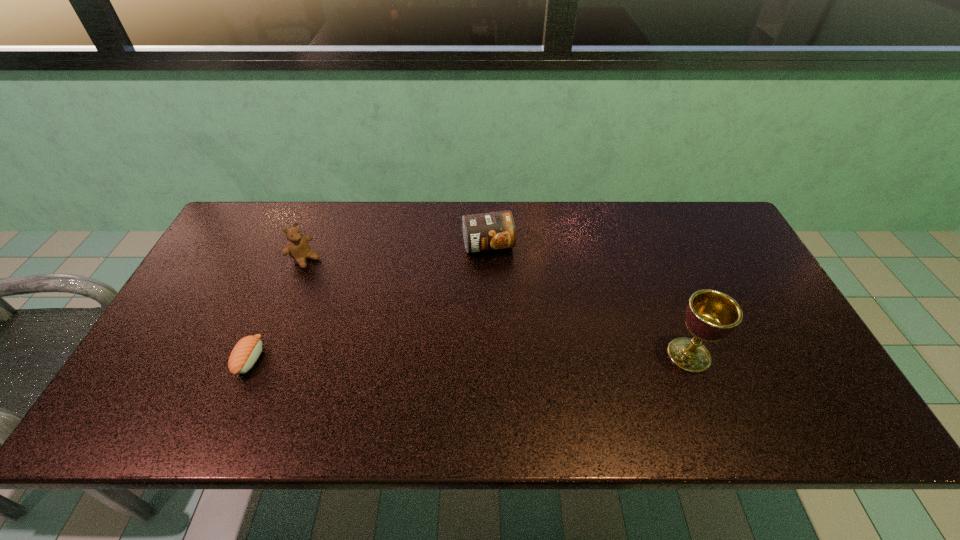
Where is `the shortest object`? the shortest object is located at coordinates (245, 353).

Find the location of a particular element. the rightmost object is located at coordinates (711, 315).

This screenshot has width=960, height=540. In order to click on chalice in this screenshot , I will do `click(711, 315)`.

Locate an element on the screen. teddy bear is located at coordinates (298, 248).

The width and height of the screenshot is (960, 540). What are the coordinates of `can` in the screenshot? It's located at (489, 231).

This screenshot has height=540, width=960. In order to click on vacant space located on the back of the sushi in this screenshot , I will do `click(280, 289)`.

Image resolution: width=960 pixels, height=540 pixels. Identify the location of vacant space located 0.340m on the left of the rightmost object. pyautogui.click(x=529, y=355).

Find the location of a particular element. free point located 0.180m on the face of the teddy bear is located at coordinates (353, 295).

Locate an element on the screen. The height and width of the screenshot is (540, 960). free space located 0.070m on the face of the teddy bear is located at coordinates (329, 277).

You are a GUI agent. You are given a task and a screenshot of the screen. Output one action in this format:
    pyautogui.click(x=<x>, y=<y>)
    Task: Click on the vacant space situated 0.200m on the face of the teddy bear
    
    Given the screenshot: What is the action you would take?
    pyautogui.click(x=358, y=299)